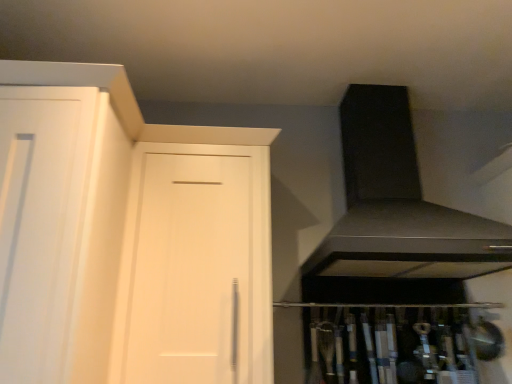
Question: Considering the relative sizes of satin black exhaust hood at upper right and white matte door at center in the image provided, is satin black exhaust hood at upper right shorter than white matte door at center?

Choices:
 (A) no
 (B) yes

Answer: (B)

Question: Can you confirm if satin black exhaust hood at upper right is smaller than white matte door at center?

Choices:
 (A) no
 (B) yes

Answer: (A)

Question: From the image's perspective, would you say satin black exhaust hood at upper right is positioned over white matte door at center?

Choices:
 (A) no
 (B) yes

Answer: (B)

Question: Is the position of satin black exhaust hood at upper right less distant than that of white matte door at center?

Choices:
 (A) yes
 (B) no

Answer: (A)

Question: Is satin black exhaust hood at upper right wider than white matte door at center?

Choices:
 (A) yes
 (B) no

Answer: (A)

Question: Can you confirm if satin black exhaust hood at upper right is positioned to the right of white matte door at center?

Choices:
 (A) yes
 (B) no

Answer: (A)

Question: From a real-world perspective, is white matte door at center beneath satin black exhaust hood at upper right?

Choices:
 (A) no
 (B) yes

Answer: (B)

Question: Is white matte door at center shorter than satin black exhaust hood at upper right?

Choices:
 (A) yes
 (B) no

Answer: (B)

Question: Does white matte door at center have a smaller size compared to satin black exhaust hood at upper right?

Choices:
 (A) no
 (B) yes

Answer: (B)

Question: From the image's perspective, is white matte door at center on top of satin black exhaust hood at upper right?

Choices:
 (A) no
 (B) yes

Answer: (A)

Question: Can you confirm if white matte door at center is wider than satin black exhaust hood at upper right?

Choices:
 (A) no
 (B) yes

Answer: (A)

Question: Is white matte door at center at the right side of satin black exhaust hood at upper right?

Choices:
 (A) yes
 (B) no

Answer: (B)

Question: Based on their sizes in the image, would you say satin black exhaust hood at upper right is bigger or smaller than white matte door at center?

Choices:
 (A) big
 (B) small

Answer: (A)